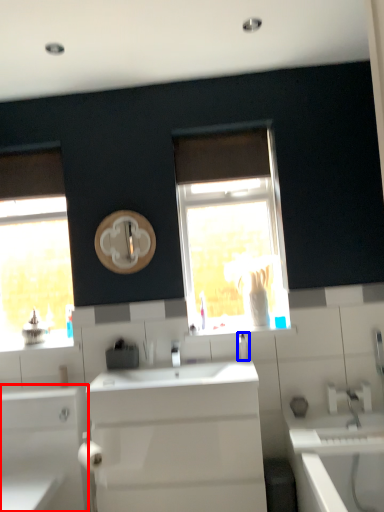
Question: Which point is closer to the camera, bathroom cabinet (highlighted by a red box) or soap dispenser (highlighted by a blue box)?

Choices:
 (A) bathroom cabinet
 (B) soap dispenser

Answer: (A)